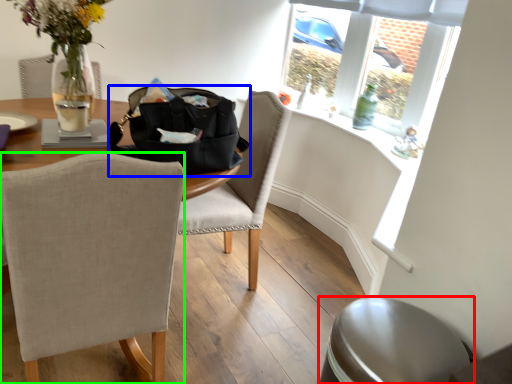
Question: Based on their relative distances, which object is farther from swivel chair (highlighted by a red box)? Choose from handbag (highlighted by a blue box) and chair (highlighted by a green box).

Choices:
 (A) handbag
 (B) chair

Answer: (A)